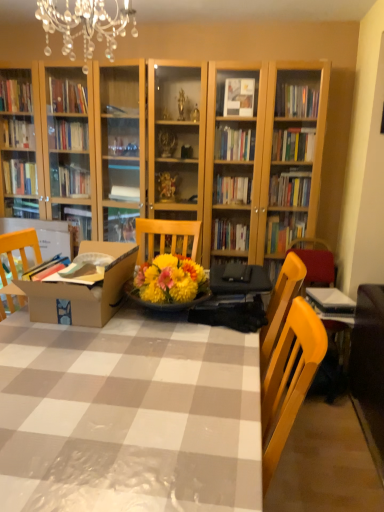
The image size is (384, 512). Identify the location of vacant area that is in front of brown cardboard box at center. (86, 364).